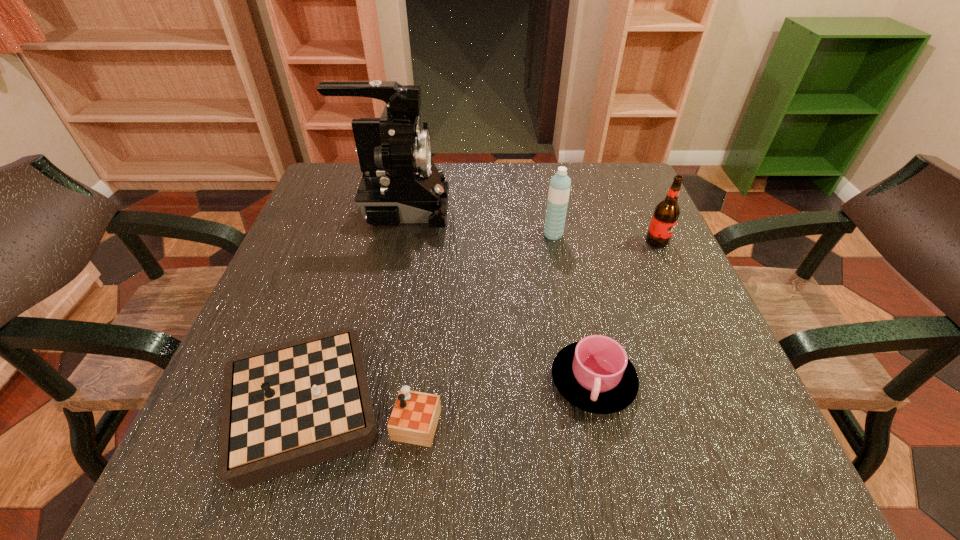
At what (x,y) coordinates should I click in order to perform the action: click on vacant region between the camcorder and the chessboard. Please return your answer as a coordinate pair (x, y). The width and height of the screenshot is (960, 540). Looking at the image, I should click on (365, 307).

Locate an element on the screen. Image resolution: width=960 pixels, height=540 pixels. vacant space that's between the camcorder and the chessboard is located at coordinates (365, 307).

At what (x,y) coordinates should I click in order to perform the action: click on blank region between the camcorder and the chessboard. Please return your answer as a coordinate pair (x, y). The image size is (960, 540). Looking at the image, I should click on (365, 307).

In order to click on object that is the third nearest to the rightmost object in this screenshot , I will do `click(400, 183)`.

Point out which object is positioned as the fourth nearest to the camcorder. Please provide its 2D coordinates. Your answer should be formatted as a tuple, i.e. [(x, y)], where the tuple contains the x and y coordinates of a point satisfying the conditions above.

[(666, 213)]

The width and height of the screenshot is (960, 540). Find the location of `vacant position in the image that satisfies the following two spatial constraints: 1. on the lens mount of the water bottle; 2. on the left side of the camcorder`. vacant position in the image that satisfies the following two spatial constraints: 1. on the lens mount of the water bottle; 2. on the left side of the camcorder is located at coordinates (393, 234).

Where is `free space that satisfies the following two spatial constraints: 1. on the back side of the water bottle; 2. on the right side of the chessboard`? free space that satisfies the following two spatial constraints: 1. on the back side of the water bottle; 2. on the right side of the chessboard is located at coordinates (377, 234).